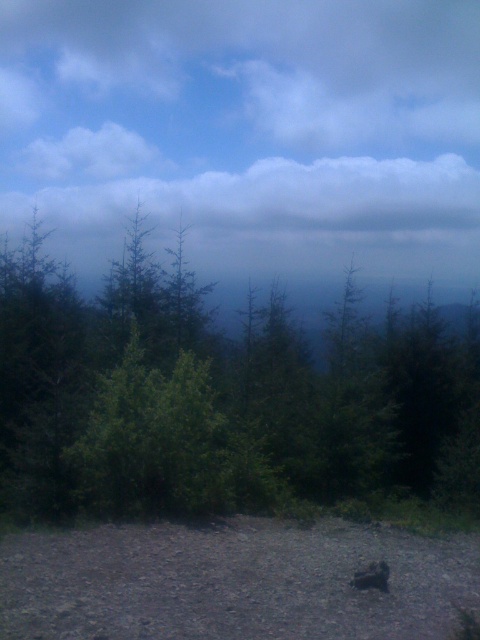
Can you confirm if green matte forest at center is positioned to the right of brown furry dog at lower center?

Incorrect, green matte forest at center is not on the right side of brown furry dog at lower center.

Is green matte forest at center taller than brown furry dog at lower center?

Yes, green matte forest at center is taller than brown furry dog at lower center.

Describe the element at coordinates (219, 397) in the screenshot. This screenshot has height=640, width=480. I see `green matte forest at center` at that location.

Identify the location of green matte forest at center. (219, 397).